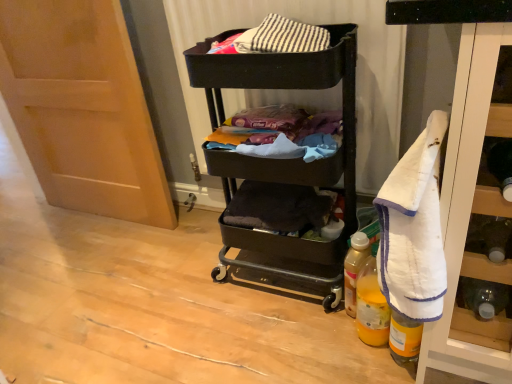
Where is `vacant area situated to the left side of yellow plastic bottle at lower right, arranged as the third bottle when viewed from the back`? This screenshot has width=512, height=384. vacant area situated to the left side of yellow plastic bottle at lower right, arranged as the third bottle when viewed from the back is located at coordinates (337, 355).